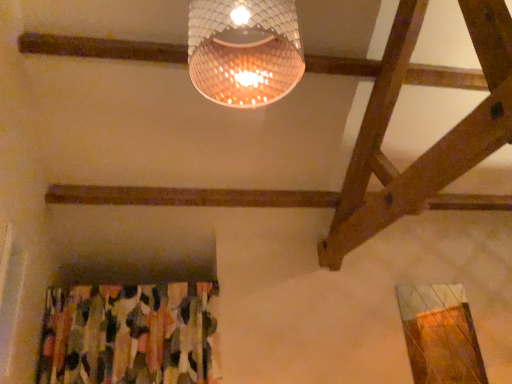
Measure the distance between translucent woven lampshade at upper center and camera.

They are 1.22 meters apart.

I want to click on translucent woven lampshade at upper center, so click(x=244, y=50).

Image resolution: width=512 pixels, height=384 pixels. What do you see at coordinates (244, 50) in the screenshot? I see `translucent woven lampshade at upper center` at bounding box center [244, 50].

What do you see at coordinates (128, 334) in the screenshot? The height and width of the screenshot is (384, 512). I see `abstract fabric curtain at lower left` at bounding box center [128, 334].

At what (x,y) coordinates should I click in order to perform the action: click on abstract fabric curtain at lower left. Please return your answer as a coordinate pair (x, y). Image resolution: width=512 pixels, height=384 pixels. Looking at the image, I should click on (128, 334).

At what (x,y) coordinates should I click in order to perform the action: click on translucent woven lampshade at upper center. Please return your answer as a coordinate pair (x, y). Looking at the image, I should click on (244, 50).

Considering the relative positions of abstract fabric curtain at lower left and translucent woven lampshade at upper center in the image provided, is abstract fabric curtain at lower left to the left of translucent woven lampshade at upper center from the viewer's perspective?

Yes.

In the scene shown: Is abstract fabric curtain at lower left positioned in front of translucent woven lampshade at upper center?

No.

Between point (112, 329) and point (274, 53), which one is positioned behind?

The point (112, 329) is farther from the camera.

From the image's perspective, is abstract fabric curtain at lower left located beneath translucent woven lampshade at upper center?

Correct, abstract fabric curtain at lower left appears lower than translucent woven lampshade at upper center in the image.

From a real-world perspective, who is located lower, abstract fabric curtain at lower left or translucent woven lampshade at upper center?

From a 3D spatial view, abstract fabric curtain at lower left is below.

Between abstract fabric curtain at lower left and translucent woven lampshade at upper center, which one has smaller width?

abstract fabric curtain at lower left.

Who is taller, abstract fabric curtain at lower left or translucent woven lampshade at upper center?

abstract fabric curtain at lower left is taller.

Can you confirm if abstract fabric curtain at lower left is smaller than translucent woven lampshade at upper center?

Actually, abstract fabric curtain at lower left might be larger than translucent woven lampshade at upper center.

Does abstract fabric curtain at lower left contain translucent woven lampshade at upper center?

No, translucent woven lampshade at upper center is not surrounded by abstract fabric curtain at lower left.

Would you consider abstract fabric curtain at lower left to be distant from translucent woven lampshade at upper center?

Yes, abstract fabric curtain at lower left and translucent woven lampshade at upper center are quite far apart.

Is abstract fabric curtain at lower left positioned with its back to translucent woven lampshade at upper center?

abstract fabric curtain at lower left does not have its back to translucent woven lampshade at upper center.

From the picture: What's the angular difference between abstract fabric curtain at lower left and translucent woven lampshade at upper center's facing directions?

There is a 87.9-degree angle between the facing directions of abstract fabric curtain at lower left and translucent woven lampshade at upper center.

Image resolution: width=512 pixels, height=384 pixels. In the image, there is a abstract fabric curtain at lower left. Find the location of `lamp above it (from the image's perspective)`. lamp above it (from the image's perspective) is located at coordinates click(x=244, y=50).

Is translucent woven lampshade at upper center to the left or to the right of abstract fabric curtain at lower left in the image?

translucent woven lampshade at upper center is positioned on abstract fabric curtain at lower left's right side.

Considering the positions of objects translucent woven lampshade at upper center and abstract fabric curtain at lower left in the image provided, who is in front, translucent woven lampshade at upper center or abstract fabric curtain at lower left?

translucent woven lampshade at upper center is in front.

Does point (274, 76) lie behind point (42, 353)?

No, (274, 76) is closer to viewer.

From the image's perspective, which one is positioned lower, translucent woven lampshade at upper center or abstract fabric curtain at lower left?

abstract fabric curtain at lower left is shown below in the image.

From a real-world perspective, is translucent woven lampshade at upper center on abstract fabric curtain at lower left?

Yes.

Considering the relative sizes of translucent woven lampshade at upper center and abstract fabric curtain at lower left in the image provided, is translucent woven lampshade at upper center wider than abstract fabric curtain at lower left?

Indeed, translucent woven lampshade at upper center has a greater width compared to abstract fabric curtain at lower left.

Considering the sizes of objects translucent woven lampshade at upper center and abstract fabric curtain at lower left in the image provided, who is shorter, translucent woven lampshade at upper center or abstract fabric curtain at lower left?

translucent woven lampshade at upper center is shorter.

Who is bigger, translucent woven lampshade at upper center or abstract fabric curtain at lower left?

abstract fabric curtain at lower left.

Is abstract fabric curtain at lower left a part of translucent woven lampshade at upper center?

No.

Is translucent woven lampshade at upper center touching abstract fabric curtain at lower left?

No, translucent woven lampshade at upper center is not touching abstract fabric curtain at lower left.

Looking at this image, could you tell me if translucent woven lampshade at upper center is turned towards abstract fabric curtain at lower left?

No, translucent woven lampshade at upper center is not facing towards abstract fabric curtain at lower left.

Measure the distance from translucent woven lampshade at upper center to abstract fabric curtain at lower left.

translucent woven lampshade at upper center is 6.41 feet away from abstract fabric curtain at lower left.

At what (x,y) coordinates should I click in order to perform the action: click on curtain on the left of translucent woven lampshade at upper center. Please return your answer as a coordinate pair (x, y). This screenshot has width=512, height=384. Looking at the image, I should click on (128, 334).

Locate an element on the screen. Image resolution: width=512 pixels, height=384 pixels. curtain located below the translucent woven lampshade at upper center (from the image's perspective) is located at coordinates (128, 334).

At what (x,y) coordinates should I click in order to perform the action: click on curtain on the left side of translucent woven lampshade at upper center. Please return your answer as a coordinate pair (x, y). This screenshot has height=384, width=512. Looking at the image, I should click on (128, 334).